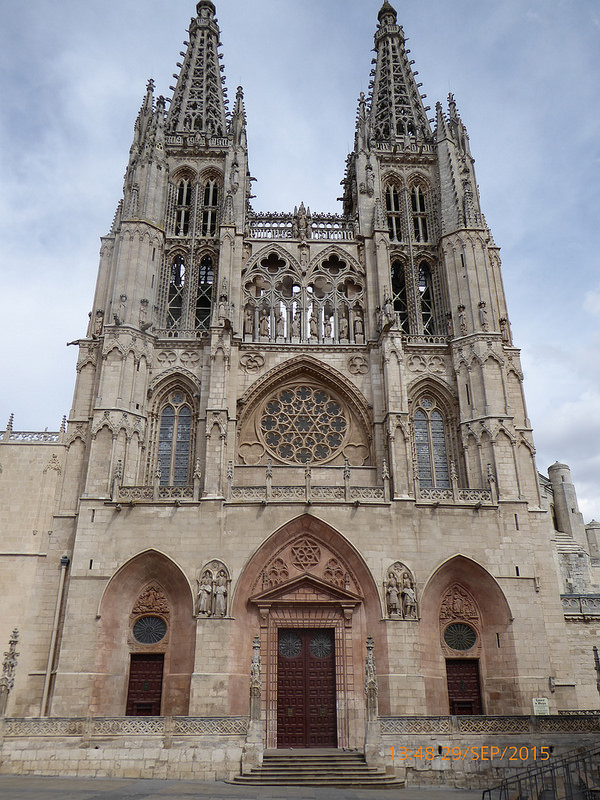
The height and width of the screenshot is (800, 600). In order to click on small door in this screenshot , I will do `click(153, 680)`, `click(469, 682)`.